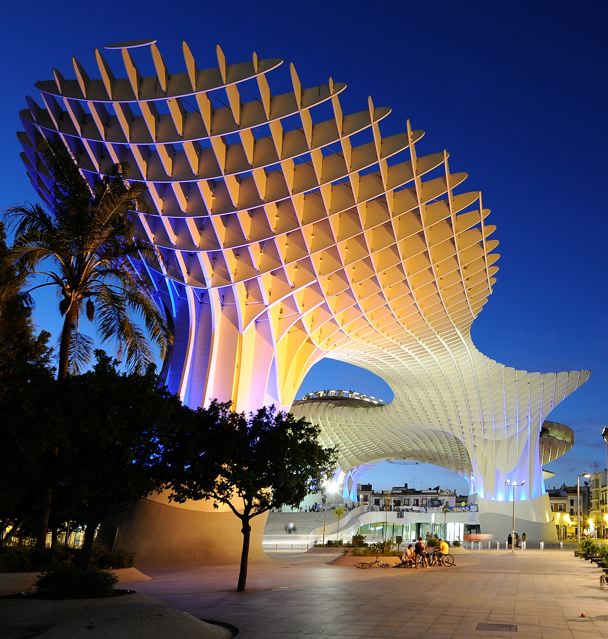
Locate an element on the screen. The image size is (608, 639). glass is located at coordinates (439, 527), (371, 526), (396, 527).